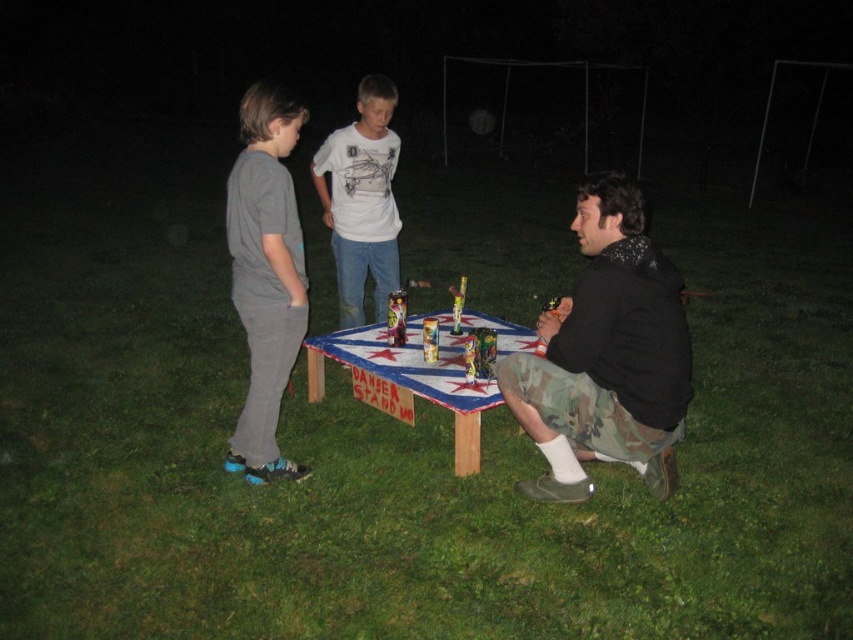
Which is more to the right, gray cotton pants at left or wooden painted table at center?

Positioned to the right is wooden painted table at center.

Looking at this image, can you confirm if gray cotton pants at left is taller than wooden painted table at center?

Correct, gray cotton pants at left is much taller as wooden painted table at center.

Which is behind, point (230, 253) or point (357, 348)?

Point (230, 253)

Identify the location of gray cotton pants at left. This screenshot has width=853, height=640. (265, 275).

Can you confirm if wooden painted table at center is thinner than white cotton shirt at center?

In fact, wooden painted table at center might be wider than white cotton shirt at center.

Can you confirm if wooden painted table at center is positioned below white cotton shirt at center?

Indeed, wooden painted table at center is positioned under white cotton shirt at center.

This screenshot has width=853, height=640. What do you see at coordinates (418, 372) in the screenshot?
I see `wooden painted table at center` at bounding box center [418, 372].

In order to click on wooden painted table at center in this screenshot , I will do `click(418, 372)`.

Describe the element at coordinates (605, 355) in the screenshot. I see `camo shorts at lower right` at that location.

This screenshot has height=640, width=853. In order to click on camo shorts at lower right in this screenshot , I will do `click(605, 355)`.

What are the coordinates of `camo shorts at lower right` in the screenshot? It's located at (605, 355).